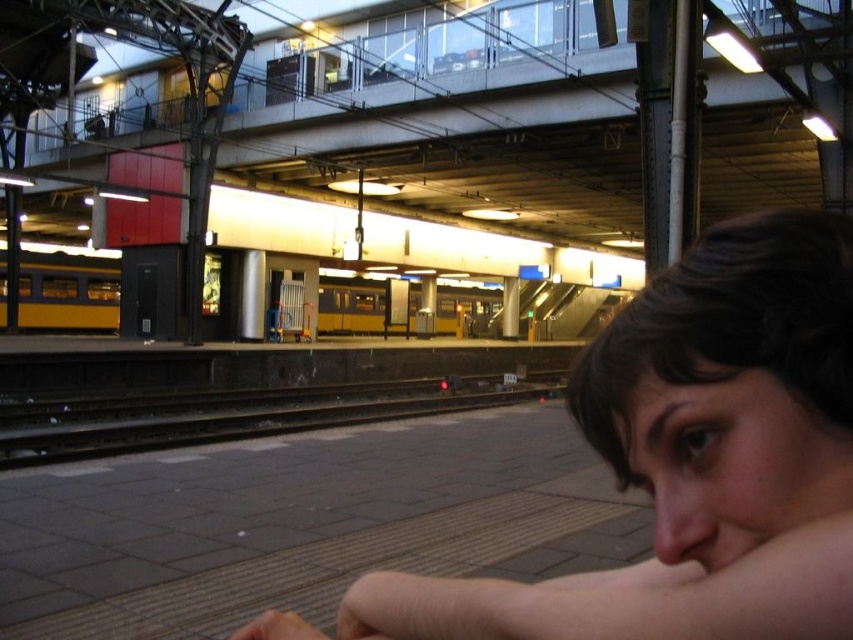
Can you confirm if black metal train track at center is wider than yellow matte train at center?

Incorrect, black metal train track at center's width does not surpass yellow matte train at center's.

Can you confirm if black metal train track at center is shorter than yellow matte train at center?

Indeed, black metal train track at center has a lesser height compared to yellow matte train at center.

Which is in front, point (112, 404) or point (370, 312)?

Point (112, 404) is more forward.

You are a GUI agent. You are given a task and a screenshot of the screen. Output one action in this format:
    pyautogui.click(x=<x>, y=<y>)
    Task: Click on the black metal train track at center
    This screenshot has width=853, height=640.
    Given the screenshot: What is the action you would take?
    pyautogui.click(x=236, y=413)

Who is more distant from viewer, (750, 504) or (370, 310)?

The point (370, 310) is behind.

Looking at this image, is dark brown hair at center positioned behind yellow matte train at center?

No, dark brown hair at center is closer to the viewer.

Where is `dark brown hair at center`? Image resolution: width=853 pixels, height=640 pixels. dark brown hair at center is located at coordinates (695, 458).

Does dark brown hair at center have a greater width compared to black metal train track at center?

In fact, dark brown hair at center might be narrower than black metal train track at center.

Which is more to the right, dark brown hair at center or black metal train track at center?

dark brown hair at center is more to the right.

Between point (772, 449) and point (90, 417), which one is positioned behind?

Point (90, 417)

This screenshot has height=640, width=853. I want to click on dark brown hair at center, so click(x=695, y=458).